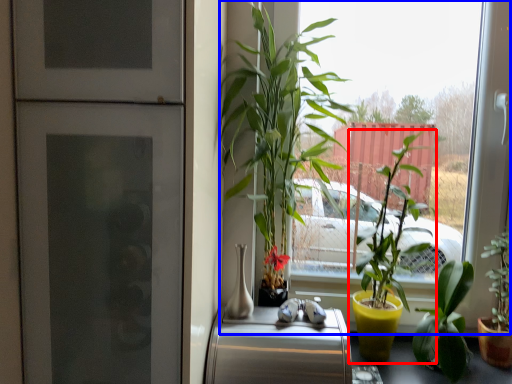
Question: Which point is closer to the camera, houseplant (highlighted by a red box) or window (highlighted by a blue box)?

Choices:
 (A) houseplant
 (B) window

Answer: (B)